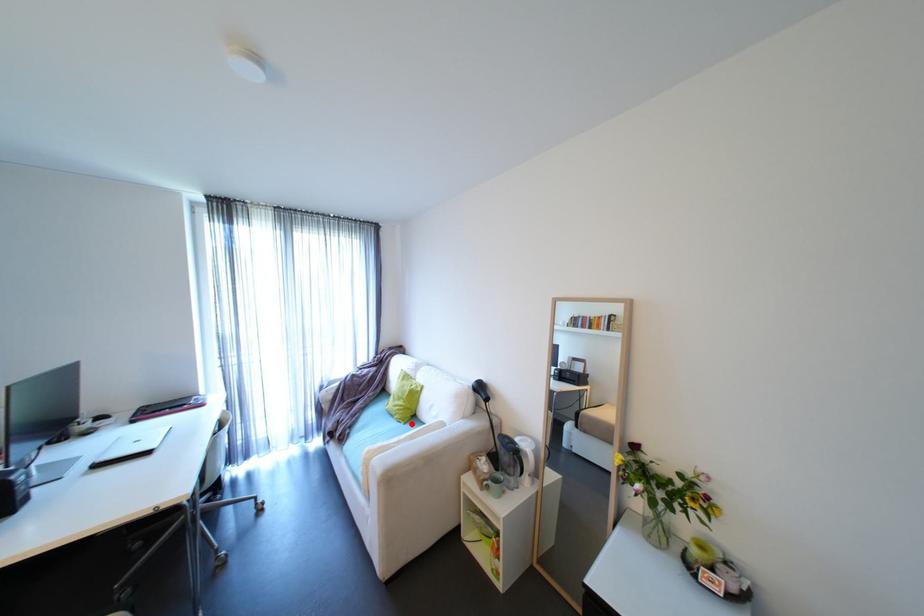
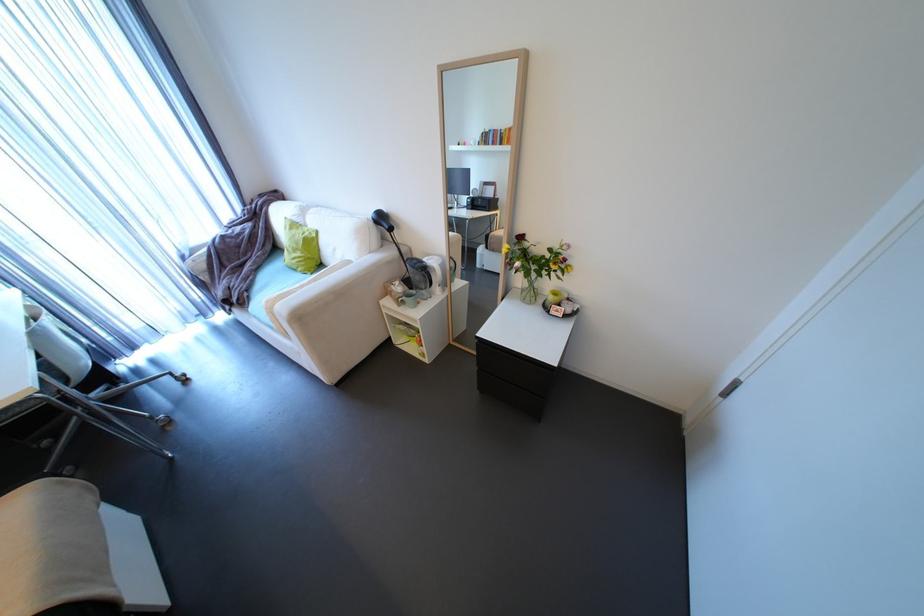
Find the pixel in the second image that matches the highlighted location in the first image.

(319, 274)